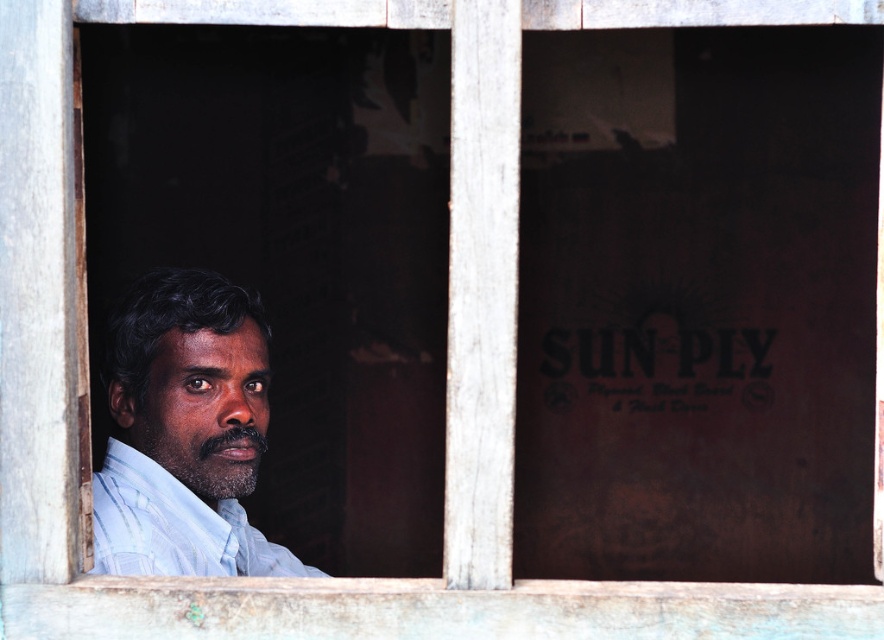
Question: Does light blue shirt at center have a larger size compared to light blue cotton shirt at left?

Choices:
 (A) yes
 (B) no

Answer: (A)

Question: Which point is closer to the camera taking this photo?

Choices:
 (A) (250, 348)
 (B) (122, 528)

Answer: (B)

Question: Does light blue shirt at center appear on the right side of light blue cotton shirt at left?

Choices:
 (A) no
 (B) yes

Answer: (B)

Question: Which object appears closest to the camera in this image?

Choices:
 (A) light blue shirt at center
 (B) light blue cotton shirt at left

Answer: (B)

Question: Which object appears farthest from the camera in this image?

Choices:
 (A) light blue cotton shirt at left
 (B) light blue shirt at center

Answer: (B)

Question: Is light blue shirt at center to the right of light blue cotton shirt at left from the viewer's perspective?

Choices:
 (A) no
 (B) yes

Answer: (B)